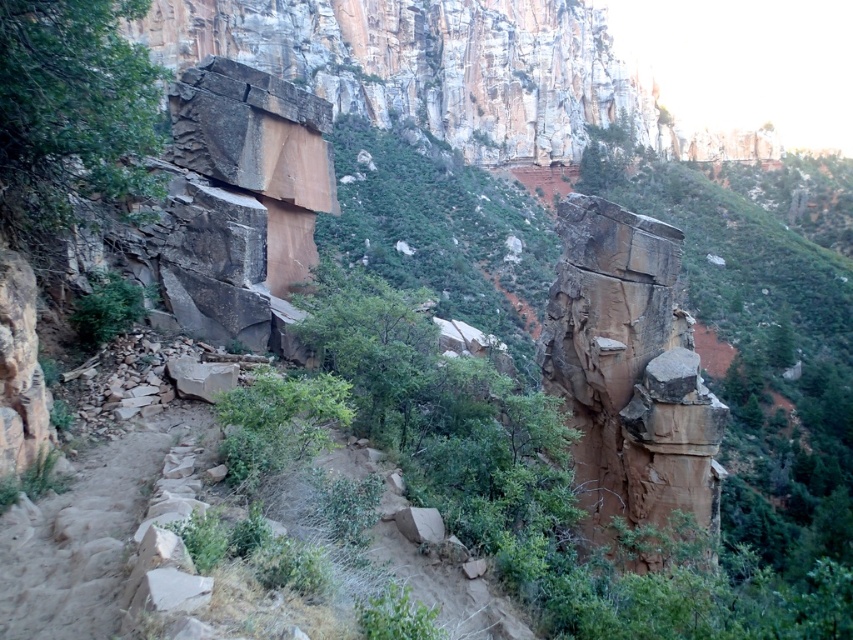
Question: Does brown rough rock at center lie in front of green leafy shrub at center-left?

Choices:
 (A) no
 (B) yes

Answer: (B)

Question: Which point is farther to the camera?

Choices:
 (A) brown rough rock at center
 (B) green leafy shrub at center-left

Answer: (B)

Question: Is brown rough rock at center smaller than green leafy shrub at center-left?

Choices:
 (A) yes
 (B) no

Answer: (B)

Question: From the image, what is the correct spatial relationship of brown rough rock at center in relation to green leafy shrub at center-left?

Choices:
 (A) right
 (B) left

Answer: (A)

Question: Among these points, which one is farthest from the camera?

Choices:
 (A) (656, 314)
 (B) (80, 305)

Answer: (A)